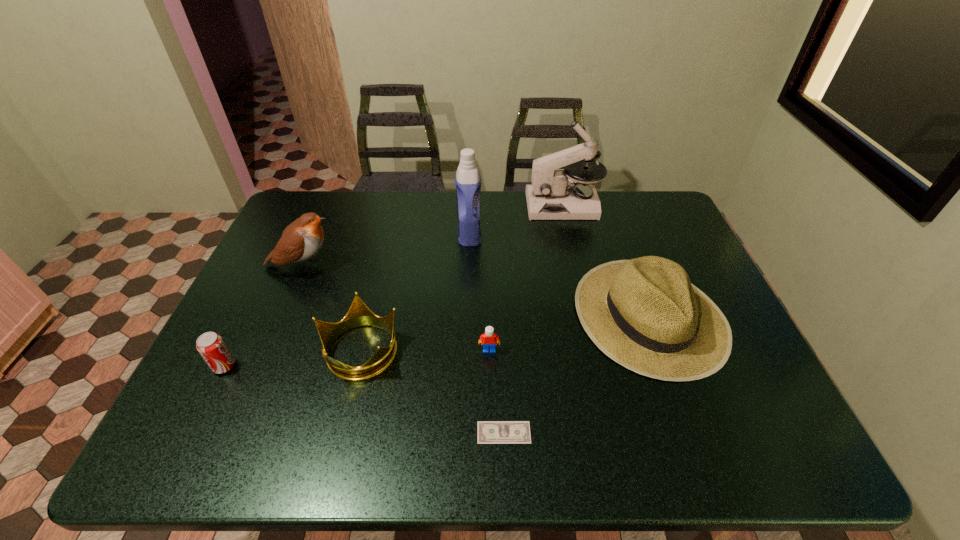
Find the location of a particular element. microscope is located at coordinates (551, 196).

Where is `detergent`? The height and width of the screenshot is (540, 960). detergent is located at coordinates (468, 183).

Image resolution: width=960 pixels, height=540 pixels. In order to click on bird in this screenshot , I will do `click(302, 239)`.

Image resolution: width=960 pixels, height=540 pixels. Find the location of `sunhat`. sunhat is located at coordinates (645, 314).

The image size is (960, 540). Find the location of `crown`. crown is located at coordinates (358, 315).

Locate an element on the screen. Image resolution: width=960 pixels, height=540 pixels. soda can is located at coordinates (211, 346).

This screenshot has width=960, height=540. In order to click on Lego in this screenshot , I will do `click(489, 338)`.

You are a GUI agent. You are given a task and a screenshot of the screen. Output one action in this format:
    pyautogui.click(x=<x>, y=<y>)
    Task: Click on the shortest object
    Image resolution: width=960 pixels, height=540 pixels.
    Given the screenshot: What is the action you would take?
    pyautogui.click(x=488, y=432)

The image size is (960, 540). I want to click on money, so click(488, 432).

You are a GUI agent. You are given a task and a screenshot of the screen. Output one action in this format:
    pyautogui.click(x=<x>, y=<y>)
    Task: Click on the vacant space situated at the eyepiece of the microscope
    Image resolution: width=960 pixels, height=540 pixels.
    Given the screenshot: What is the action you would take?
    pyautogui.click(x=465, y=206)